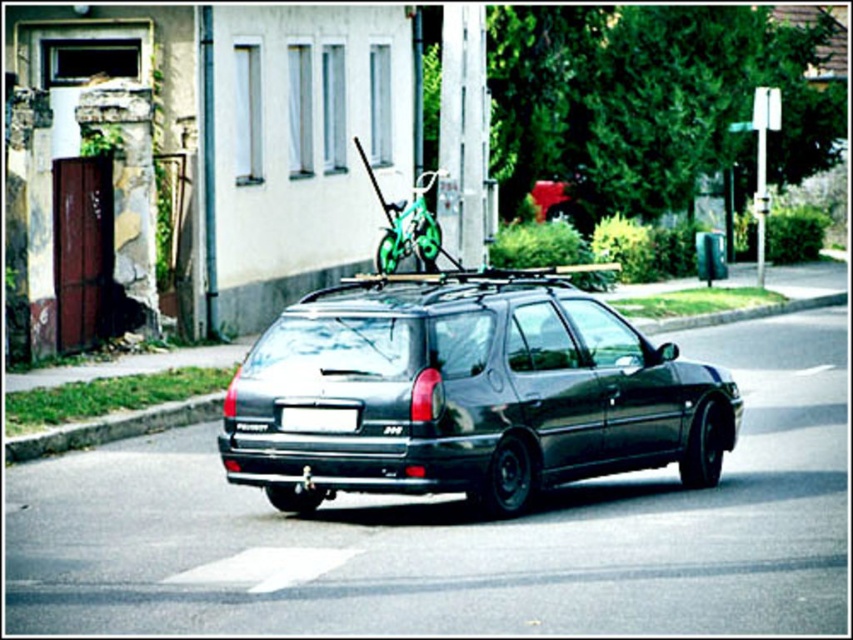
Where is the shiny black car at center located in the image?

The shiny black car at center is located at point (468,392).